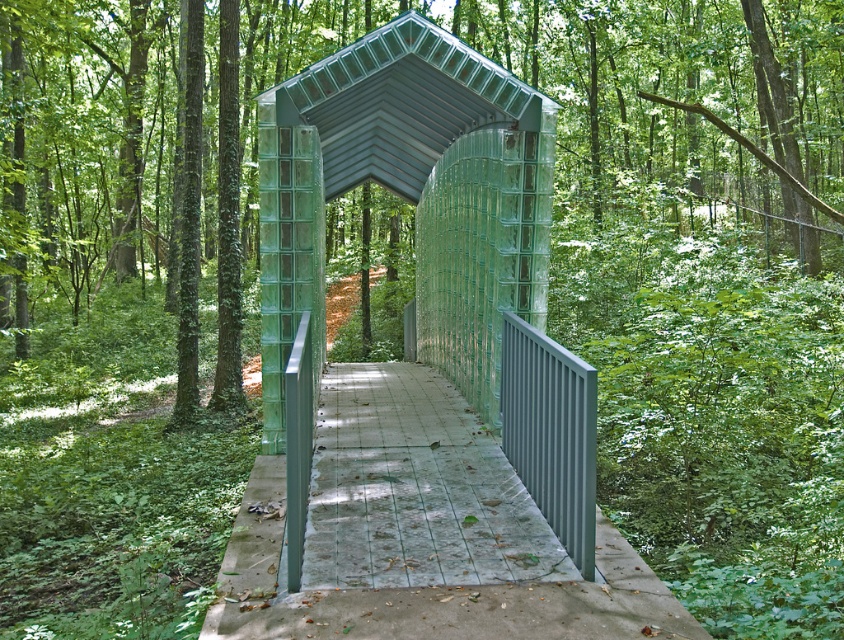
Question: Does transparent glass gazebo at center have a smaller size compared to smooth concrete path at center?

Choices:
 (A) no
 (B) yes

Answer: (B)

Question: Where is transparent glass gazebo at center located in relation to smooth concrete path at center in the image?

Choices:
 (A) left
 (B) right

Answer: (A)

Question: Is transparent glass gazebo at center below smooth concrete path at center?

Choices:
 (A) yes
 (B) no

Answer: (B)